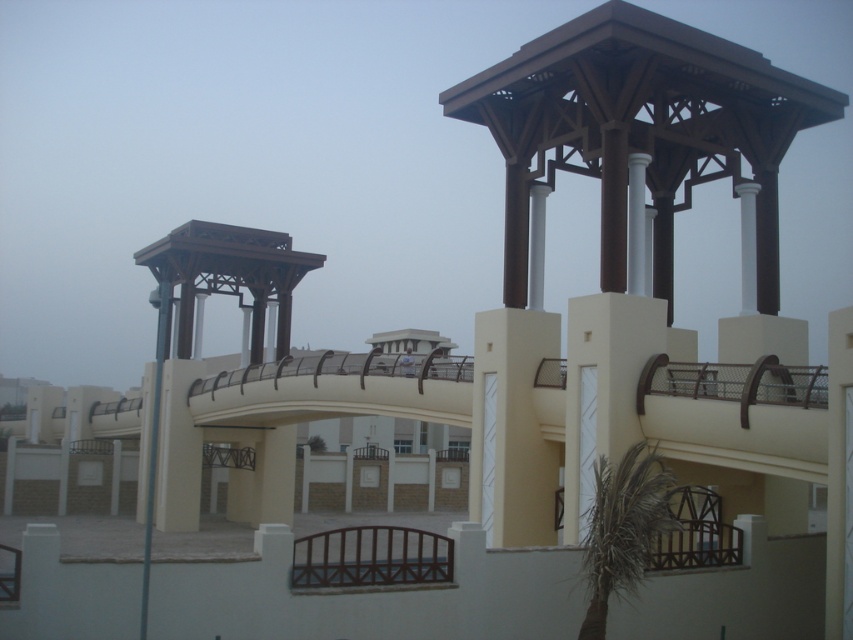
Question: Can you confirm if green leafy palm tree at lower right is positioned above metallic pole at left?

Choices:
 (A) no
 (B) yes

Answer: (A)

Question: Which point is closer to the camera taking this photo?

Choices:
 (A) (144, 536)
 (B) (583, 632)

Answer: (B)

Question: Which of the following is the closest to the observer?

Choices:
 (A) (601, 513)
 (B) (141, 621)

Answer: (B)

Question: Can you confirm if green leafy palm tree at lower right is positioned below metallic pole at left?

Choices:
 (A) no
 (B) yes

Answer: (B)

Question: Is green leafy palm tree at lower right below metallic pole at left?

Choices:
 (A) yes
 (B) no

Answer: (A)